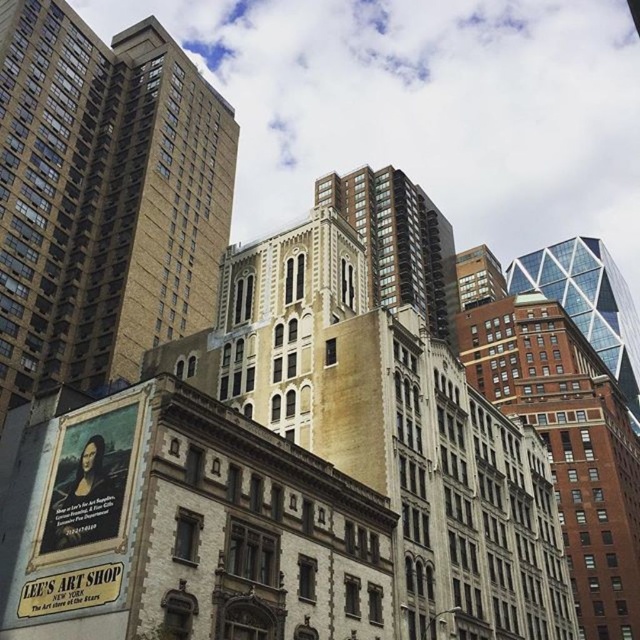
You are an architect analyzing the urban skyline. Based on the image, which of the two structures, the beige stone building at left or the glassy steel skyscraper at upper right, has a more compact footprint and why?

The beige stone building at left has a more compact footprint because it is smaller than the glassy steel skyscraper at upper right.

You are standing in the city square and see the gold brick building at center and the glassy steel skyscraper at upper right. Which building is closer to the left side of the square?

The gold brick building at center is to the left of the glassy steel skyscraper at upper right, so it is closer to the left side of the square.